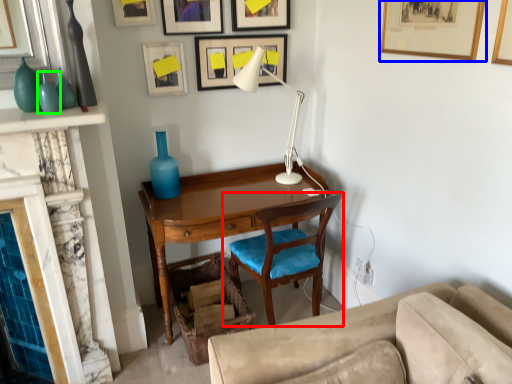
Question: Which object is positioned closest to chair (highlighted by a red box)? Select from picture frame (highlighted by a blue box) and turquoise (highlighted by a green box).

Choices:
 (A) picture frame
 (B) turquoise

Answer: (A)